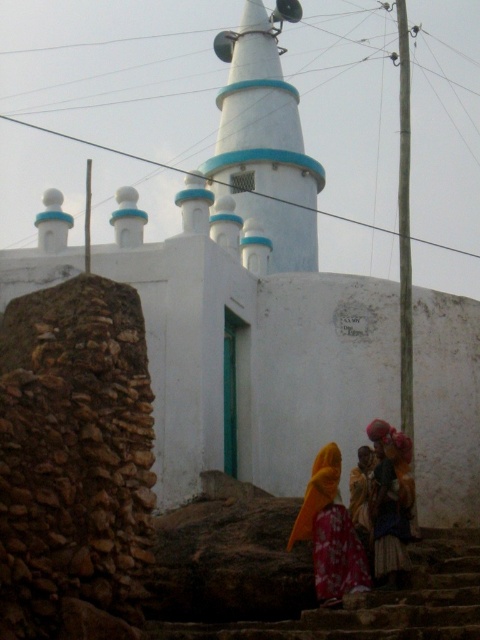
Can you confirm if stone stairs at lower center is wider than floral fabric dress at lower center?

Yes, stone stairs at lower center is wider than floral fabric dress at lower center.

Does stone stairs at lower center come behind floral fabric dress at lower center?

No, it is in front of floral fabric dress at lower center.

Is point (345, 604) positioned behind point (334, 513)?

That is False.

The width and height of the screenshot is (480, 640). I want to click on stone stairs at lower center, so click(x=377, y=604).

Between point (289, 93) and point (476, 538), which one is positioned in front?

Point (476, 538) is in front.

Can you confirm if white painted tower at center is positioned below stone stairs at lower center?

No, white painted tower at center is not below stone stairs at lower center.

Identify the location of white painted tower at center. Image resolution: width=480 pixels, height=640 pixels. (264, 141).

Locate an element on the screen. The height and width of the screenshot is (640, 480). white painted tower at center is located at coordinates (264, 141).

Is orange fabric headscarf at lower center thinner than orange fabric headscarf at lower right?

In fact, orange fabric headscarf at lower center might be wider than orange fabric headscarf at lower right.

Is point (332, 532) behind point (402, 465)?

No, (332, 532) is closer to viewer.

Where is `orange fabric headscarf at lower center`? This screenshot has height=640, width=480. orange fabric headscarf at lower center is located at coordinates (330, 532).